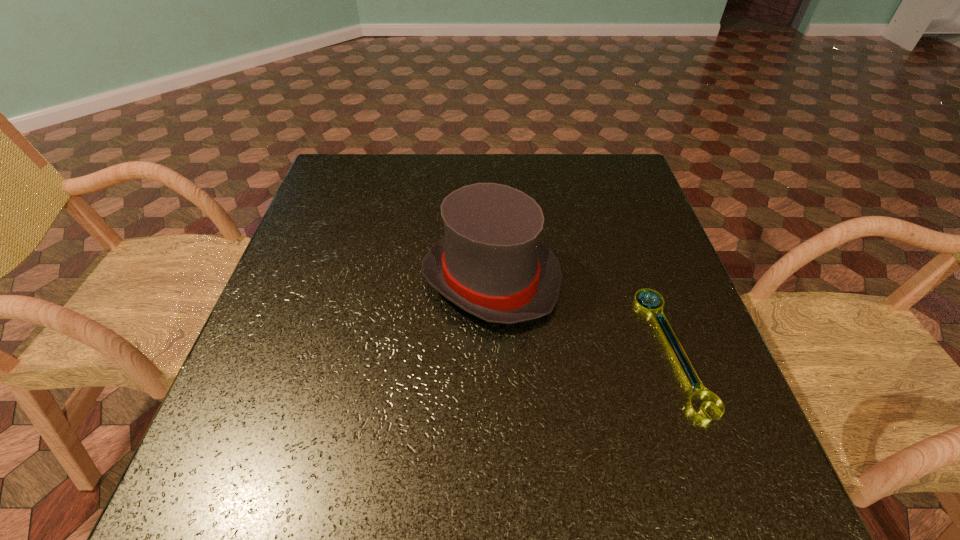
At what (x,y) coordinates should I click in order to perform the action: click on dress hat. Please return your answer as a coordinate pair (x, y). The image size is (960, 540). Looking at the image, I should click on (491, 263).

The width and height of the screenshot is (960, 540). In order to click on the left object in this screenshot , I will do `click(491, 263)`.

Where is `the right object`? This screenshot has height=540, width=960. the right object is located at coordinates (649, 309).

Locate an element on the screen. The height and width of the screenshot is (540, 960). the shorter object is located at coordinates (649, 309).

This screenshot has height=540, width=960. Identify the location of vacant area situated on the back of the taller object. (489, 165).

Where is `vacant space situated 0.050m on the front of the wrench`? Image resolution: width=960 pixels, height=540 pixels. vacant space situated 0.050m on the front of the wrench is located at coordinates (710, 453).

Locate an element on the screen. object located at the right edge is located at coordinates (649, 309).

In the image, there is a desktop. Where is `vacant space at the far edge`? vacant space at the far edge is located at coordinates (479, 163).

Identify the location of vacant space at the near edge. This screenshot has width=960, height=540. (556, 462).

This screenshot has height=540, width=960. I want to click on free spot at the left edge of the desktop, so click(x=318, y=240).